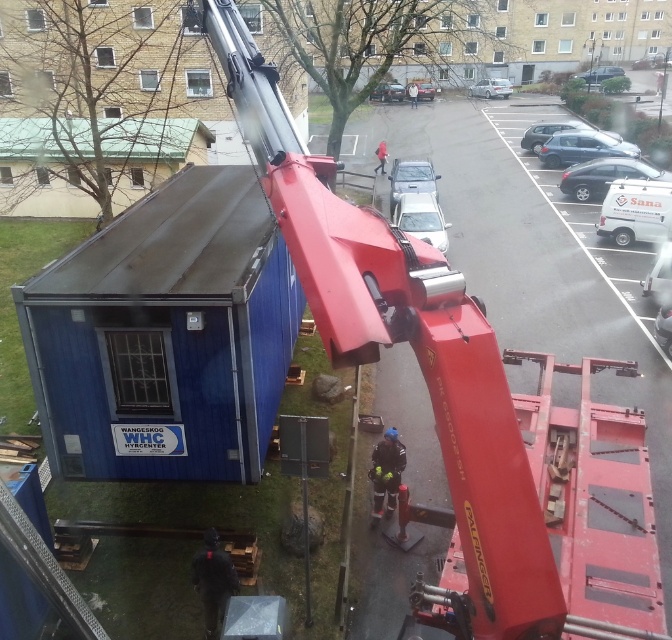
Question: Does matte black car at center appear on the left side of metallic silver car at upper right?

Choices:
 (A) yes
 (B) no

Answer: (A)

Question: Is metallic red crane arm at center smaller than silver metallic sedan at center?

Choices:
 (A) yes
 (B) no

Answer: (A)

Question: Can you confirm if silver metallic car at center is smaller than metallic silver car at upper right?

Choices:
 (A) no
 (B) yes

Answer: (B)

Question: Which point is farther to the camera?

Choices:
 (A) red fabric jacket at center
 (B) metallic silver car at center
 (C) metallic blue sedan at upper right

Answer: (A)

Question: Which point appears closest to the camera in this image?

Choices:
 (A) (585, 76)
 (B) (663, 348)

Answer: (B)

Question: Considering the real-world distances, which object is farthest from the silver metallic sedan at center?

Choices:
 (A) black fabric construction worker at center
 (B) black glossy sedan at center

Answer: (A)